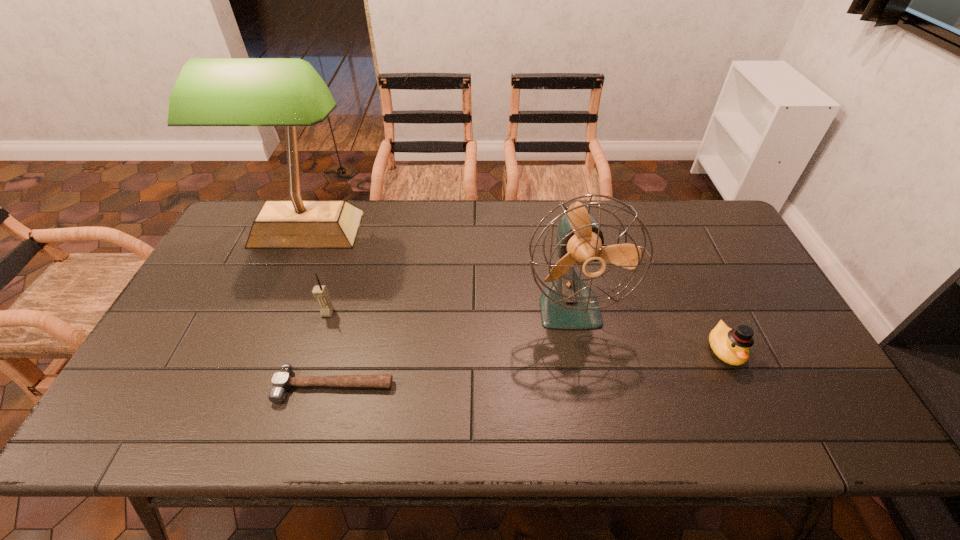
You are a GUI agent. You are given a task and a screenshot of the screen. Output one action in this format:
    pyautogui.click(x=<x>, y=<y>)
    Task: Click on the fourth closest object relative to the farthest object
    The image size is (960, 540).
    Given the screenshot: What is the action you would take?
    pyautogui.click(x=732, y=346)